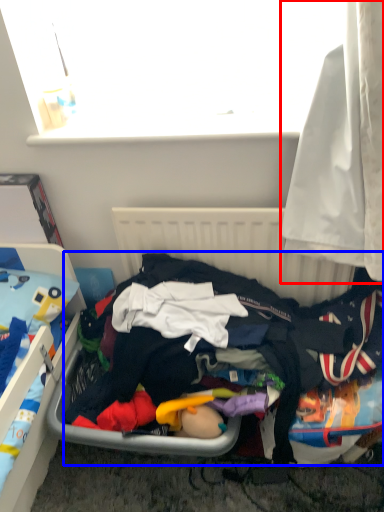
Question: Which object is closer to the camera taking this photo, curtain (highlighted by a red box) or clothing (highlighted by a blue box)?

Choices:
 (A) curtain
 (B) clothing

Answer: (A)